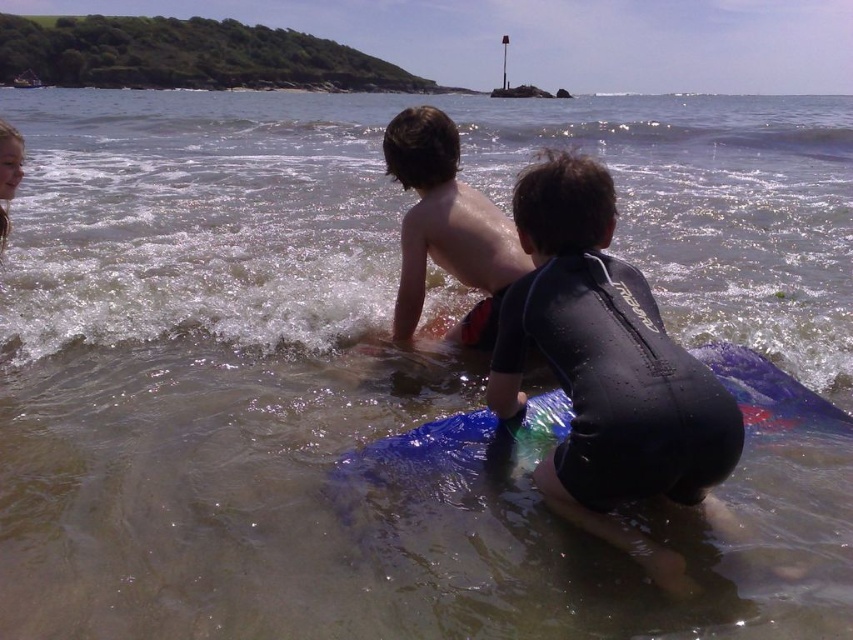
You are a photographer trying to capture the children on the beach. You need to ensure that both the shiny wet skin at center and the blue rubber surfboard at lower center are clearly visible in your shot. Given their size difference, which object will require you to focus more closely to capture details?

The blue rubber surfboard at lower center requires closer focus because it is smaller in size compared to the shiny wet skin at center, so to capture its details clearly, the photographer needs to adjust the focus accordingly.

You are a photographer trying to capture the blue rubber surfboard at lower center and the shiny wet skin at center in a single shot. Which object should you adjust your camera focus on first to ensure both are in frame?

The blue rubber surfboard at lower center is behind the shiny wet skin at center, so you should focus on the shiny wet skin at center first to ensure both are in frame.